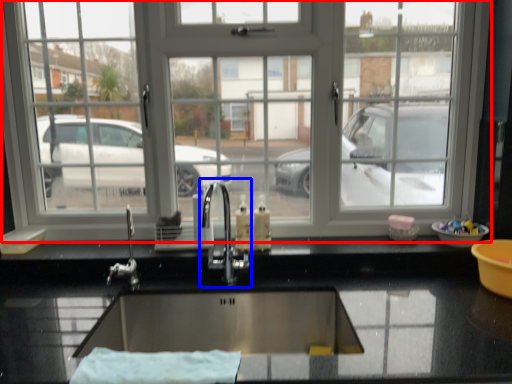
Question: Among these objects, which one is farthest to the camera, window (highlighted by a red box) or tap (highlighted by a blue box)?

Choices:
 (A) window
 (B) tap

Answer: (A)